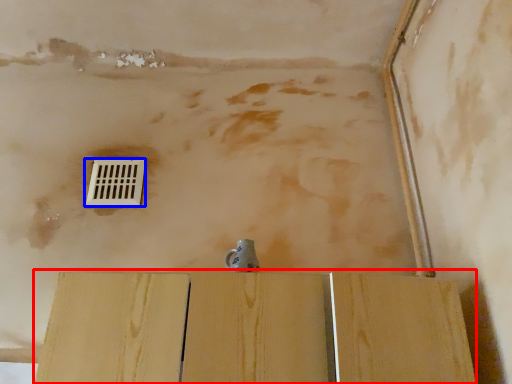
Question: Which point is closer to the camera, plywood (highlighted by a red box) or window (highlighted by a blue box)?

Choices:
 (A) plywood
 (B) window

Answer: (A)